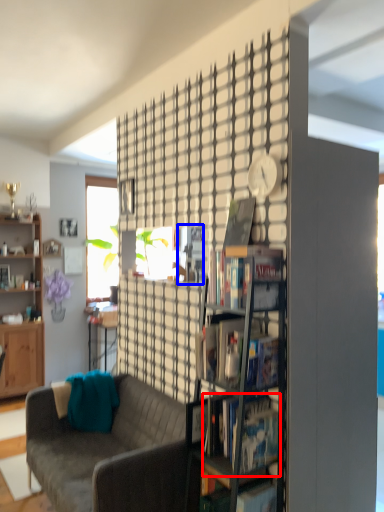
Question: Which object is closer to the camera taking this photo, book (highlighted by a red box) or magazine (highlighted by a blue box)?

Choices:
 (A) book
 (B) magazine

Answer: (A)